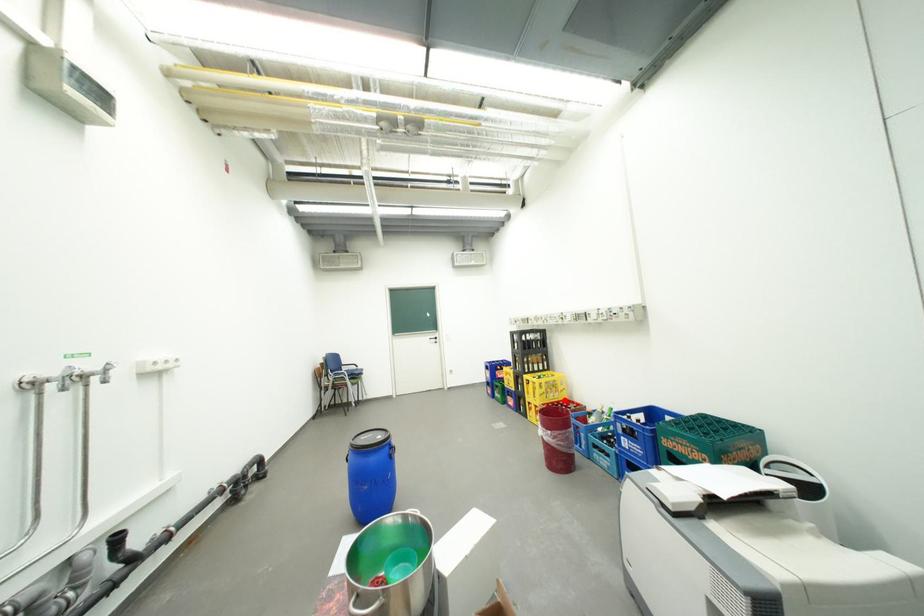
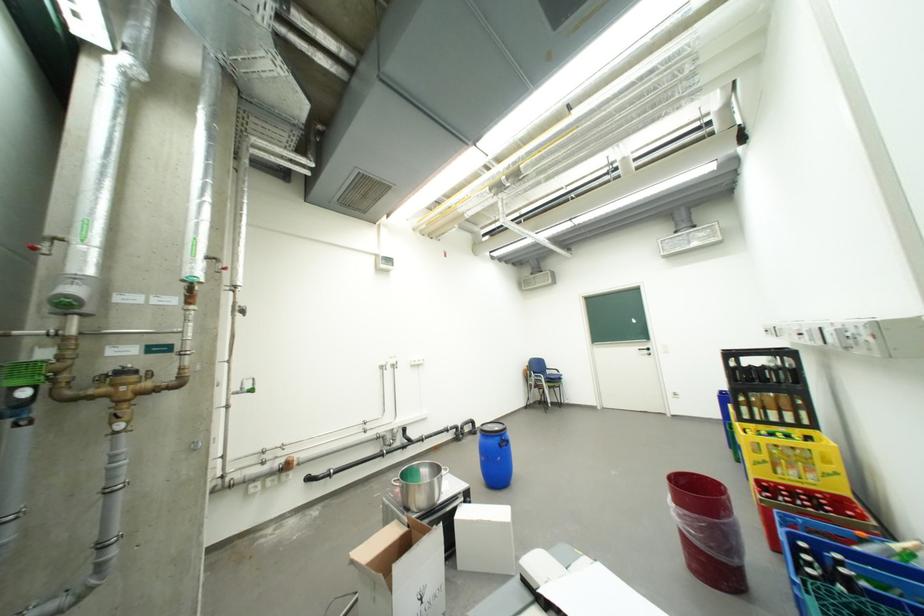
Question: I am providing you with two images of the same scene from different viewpoints. Image1 has a red point marked. In image2, the corresponding 3D location appears at what relative position? Reply with the corresponding letter.

Choices:
 (A) Closer
 (B) Farther

Answer: (A)